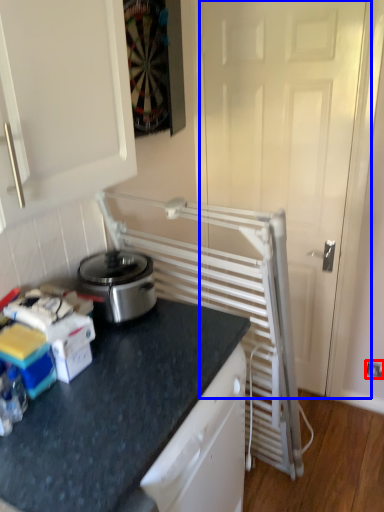
Question: Which object is closer to the camera taking this photo, electric outlet (highlighted by a red box) or screen door (highlighted by a blue box)?

Choices:
 (A) electric outlet
 (B) screen door

Answer: (B)